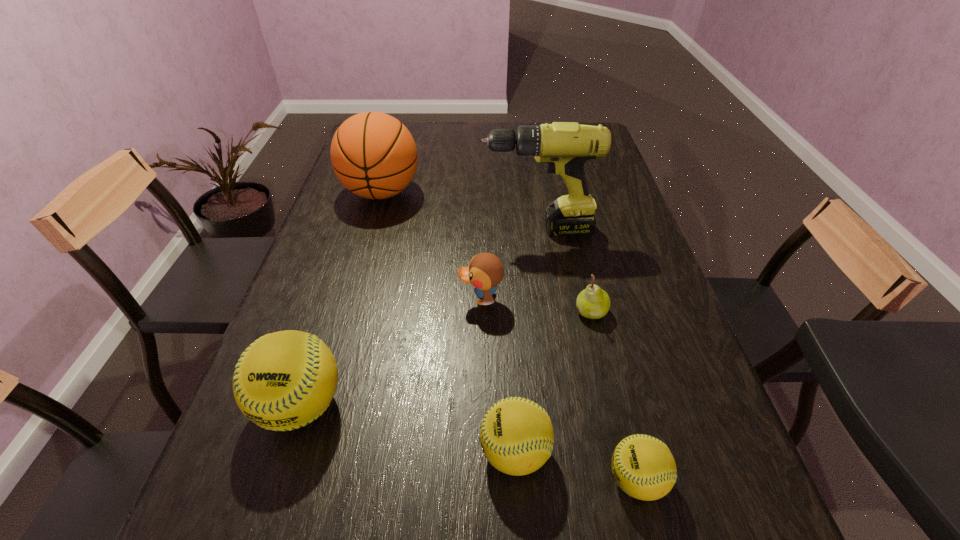
Point out which softball is positioned as the nearest to the rightmost softball. Please provide its 2D coordinates. Your answer should be formatted as a tuple, i.e. [(x, y)], where the tuple contains the x and y coordinates of a point satisfying the conditions above.

[(516, 435)]

This screenshot has height=540, width=960. Identify the location of free space that satisfies the following two spatial constraints: 1. on the front side of the pear; 2. on the left side of the basketball. (347, 312).

Find the location of a particular element. vacant space that satisfies the following two spatial constraints: 1. on the handle side of the tallest object; 2. on the back side of the pear is located at coordinates (549, 312).